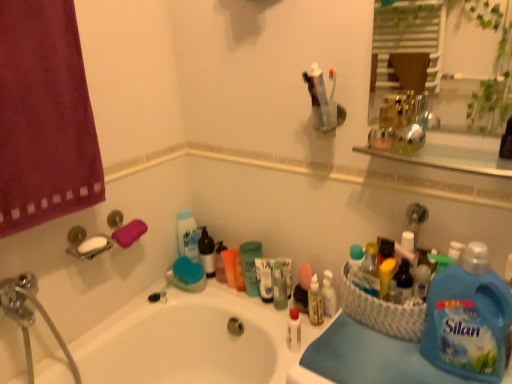
Question: Are blue fabric at lower right and translucent plastic bottle at center, which is the second toiletry in front-to-back order, making contact?

Choices:
 (A) no
 (B) yes

Answer: (A)

Question: Are blue fabric at lower right and translucent plastic bottle at center, which is the second toiletry in front-to-back order, far apart?

Choices:
 (A) no
 (B) yes

Answer: (A)

Question: Is blue fabric at lower right smaller than translucent plastic bottle at center, which is the 1th toiletry from back to front?

Choices:
 (A) yes
 (B) no

Answer: (B)

Question: Is blue fabric at lower right outside translucent plastic bottle at center, which is counted as the 2th toiletry, starting from the left?

Choices:
 (A) no
 (B) yes

Answer: (B)

Question: From the image's perspective, is blue fabric at lower right above translucent plastic bottle at center, which is the 1th toiletry from back to front?

Choices:
 (A) yes
 (B) no

Answer: (B)

Question: Considering their positions, is white glossy bottle at center, the 1th toiletry when ordered from left to right, located in front of or behind blue liquid detergent at lower right, placed as the 2th cleaning product when sorted from back to front?

Choices:
 (A) behind
 (B) front

Answer: (A)

Question: Considering the relative positions of white glossy bottle at center, the 1th toiletry when ordered from left to right, and blue liquid detergent at lower right, which is counted as the first cleaning product, starting from the right, in the image provided, is white glossy bottle at center, the 1th toiletry when ordered from left to right, to the left or to the right of blue liquid detergent at lower right, which is counted as the first cleaning product, starting from the right,?

Choices:
 (A) right
 (B) left

Answer: (B)

Question: Looking at their shapes, would you say white glossy bottle at center, marked as the second toiletry in a back-to-front arrangement, is wider or thinner than blue liquid detergent at lower right, the 2th cleaning product when ordered from left to right?

Choices:
 (A) wide
 (B) thin

Answer: (B)

Question: From the image's perspective, is white glossy bottle at center, the 1th toiletry when ordered from front to back, positioned above or below blue liquid detergent at lower right, the 2th cleaning product when ordered from left to right?

Choices:
 (A) above
 (B) below

Answer: (B)

Question: Is blue fabric at lower right bigger or smaller than blue liquid detergent at lower right, the 1th cleaning product viewed from the front?

Choices:
 (A) big
 (B) small

Answer: (B)

Question: Do you think blue fabric at lower right is within blue liquid detergent at lower right, the 2th cleaning product when ordered from left to right, or outside of it?

Choices:
 (A) outside
 (B) inside

Answer: (A)

Question: Considering their positions, is blue fabric at lower right located in front of or behind blue liquid detergent at lower right, the 2th cleaning product when ordered from left to right?

Choices:
 (A) front
 (B) behind

Answer: (B)

Question: From a real-world perspective, is blue fabric at lower right positioned above or below blue liquid detergent at lower right, the 1th cleaning product viewed from the front?

Choices:
 (A) above
 (B) below

Answer: (B)

Question: Considering their positions, is white glossy bottle at center, the 1th toiletry when ordered from front to back, located in front of or behind translucent plastic cup at center, marked as the first cleaning product in a left-to-right arrangement?

Choices:
 (A) front
 (B) behind

Answer: (A)

Question: From a real-world perspective, is white glossy bottle at center, marked as the second toiletry in a back-to-front arrangement, physically located above or below translucent plastic cup at center, arranged as the 1th cleaning product when viewed from the back?

Choices:
 (A) above
 (B) below

Answer: (B)